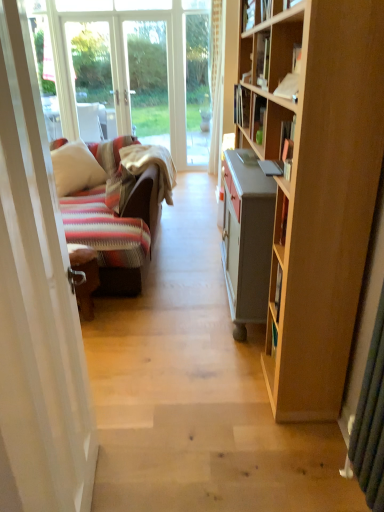
Question: From a real-world perspective, is hardcover book at upper right, the second book in the front-to-back sequence, on matte black book at upper center, which is the 1th book from front to back?

Choices:
 (A) yes
 (B) no

Answer: (B)

Question: Considering the relative positions of hardcover book at upper right, the second book in the front-to-back sequence, and matte black book at upper center, positioned as the second book in back-to-front order, in the image provided, is hardcover book at upper right, the second book in the front-to-back sequence, to the left of matte black book at upper center, positioned as the second book in back-to-front order, from the viewer's perspective?

Choices:
 (A) no
 (B) yes

Answer: (B)

Question: Considering the relative sizes of hardcover book at upper right, the second book in the front-to-back sequence, and matte black book at upper center, which is the 1th book from front to back, in the image provided, is hardcover book at upper right, the second book in the front-to-back sequence, wider than matte black book at upper center, which is the 1th book from front to back,?

Choices:
 (A) no
 (B) yes

Answer: (B)

Question: From the image's perspective, would you say hardcover book at upper right, the second book in the front-to-back sequence, is positioned over matte black book at upper center, positioned as the second book in back-to-front order?

Choices:
 (A) yes
 (B) no

Answer: (B)

Question: Does hardcover book at upper right, the 1th book positioned from the back, have a lesser width compared to matte black book at upper center, positioned as the second book in back-to-front order?

Choices:
 (A) yes
 (B) no

Answer: (B)

Question: Is hardcover book at upper right, the 1th book positioned from the back, further to the viewer compared to matte black book at upper center, positioned as the second book in back-to-front order?

Choices:
 (A) yes
 (B) no

Answer: (A)

Question: Does white glossy door at left have a smaller size compared to matte black book at upper center, positioned as the second book in back-to-front order?

Choices:
 (A) no
 (B) yes

Answer: (A)

Question: From the image's perspective, is white glossy door at left located beneath matte black book at upper center, which is the 1th book from front to back?

Choices:
 (A) yes
 (B) no

Answer: (A)

Question: Does white glossy door at left have a lesser height compared to matte black book at upper center, which is the 1th book from front to back?

Choices:
 (A) yes
 (B) no

Answer: (B)

Question: Is white glossy door at left aimed at matte black book at upper center, positioned as the second book in back-to-front order?

Choices:
 (A) yes
 (B) no

Answer: (B)

Question: Does white glossy door at left appear on the left side of matte black book at upper center, which is the 1th book from front to back?

Choices:
 (A) yes
 (B) no

Answer: (A)

Question: From a real-world perspective, is white glossy door at left positioned under matte black book at upper center, which is the 1th book from front to back, based on gravity?

Choices:
 (A) yes
 (B) no

Answer: (A)

Question: Does hardcover book at upper right, the 1th book positioned from the back, have a greater height compared to striped fabric pillow at left, acting as the second pillow starting from the left?

Choices:
 (A) yes
 (B) no

Answer: (B)